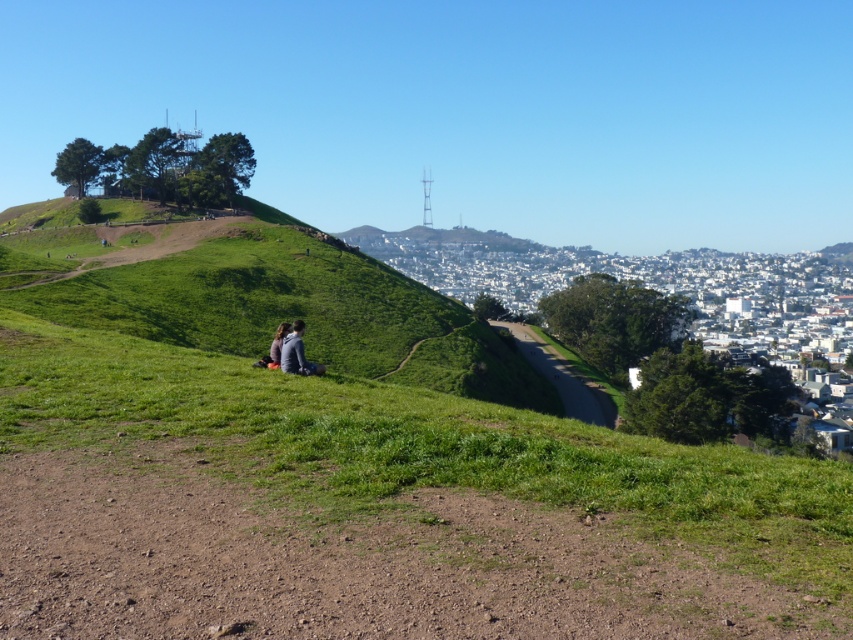
Question: Is green grassy hillside at center further to the viewer compared to dark gray jacket at center?

Choices:
 (A) yes
 (B) no

Answer: (A)

Question: In this image, where is green grassy hillside at center located relative to dark gray jacket at center?

Choices:
 (A) left
 (B) right

Answer: (A)

Question: Which point appears farthest from the camera in this image?

Choices:
 (A) (288, 356)
 (B) (432, 346)

Answer: (B)

Question: Is green grassy hillside at center thinner than dark gray jacket at center?

Choices:
 (A) no
 (B) yes

Answer: (A)